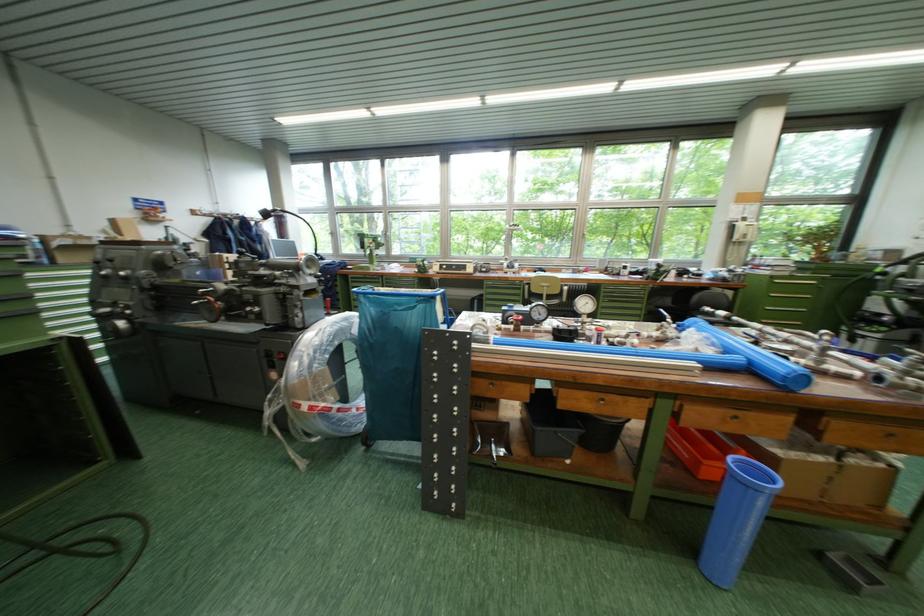
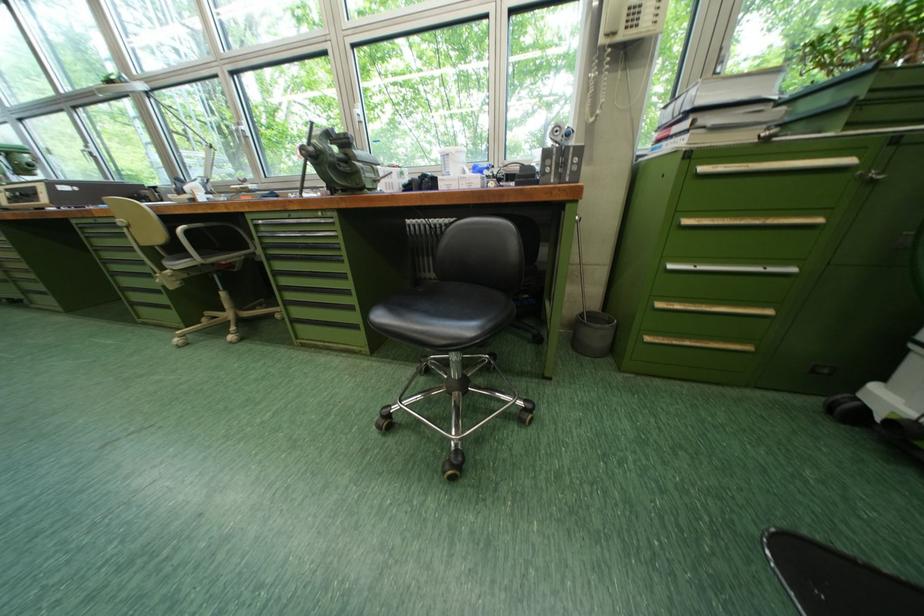
Where in the second image is the point corresponding to the point at 783,297 from the first image?

(698, 224)